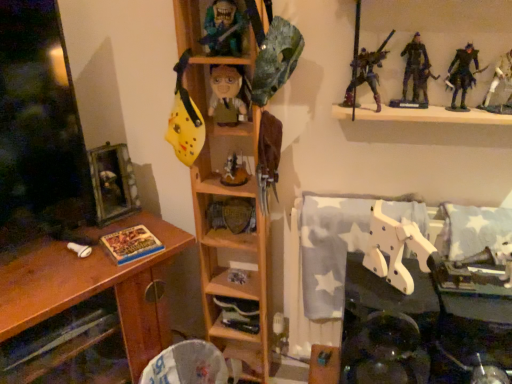
Where is `vacant space situated above brown wood desk at left (from a real-world perspective)`? vacant space situated above brown wood desk at left (from a real-world perspective) is located at coordinates (77, 249).